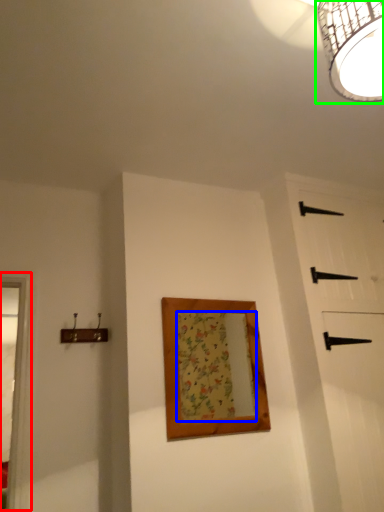
Question: Which is farther away from window frame (highlighted by a red box)? mirror (highlighted by a blue box) or lamp (highlighted by a green box)?

Choices:
 (A) mirror
 (B) lamp

Answer: (B)